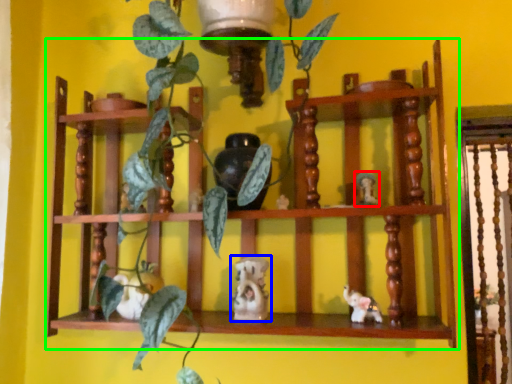
Question: Considering the real-world distances, which object is farthest from toy (highlighted by a red box)? toy (highlighted by a blue box) or shelf (highlighted by a green box)?

Choices:
 (A) toy
 (B) shelf

Answer: (B)